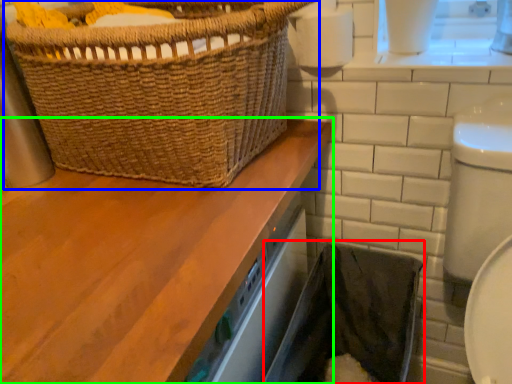
Question: Which object is positioned closest to laundry basket (highlighted by a red box)? Select from picnic basket (highlighted by a blue box) and bathroom cabinet (highlighted by a green box).

Choices:
 (A) picnic basket
 (B) bathroom cabinet

Answer: (B)